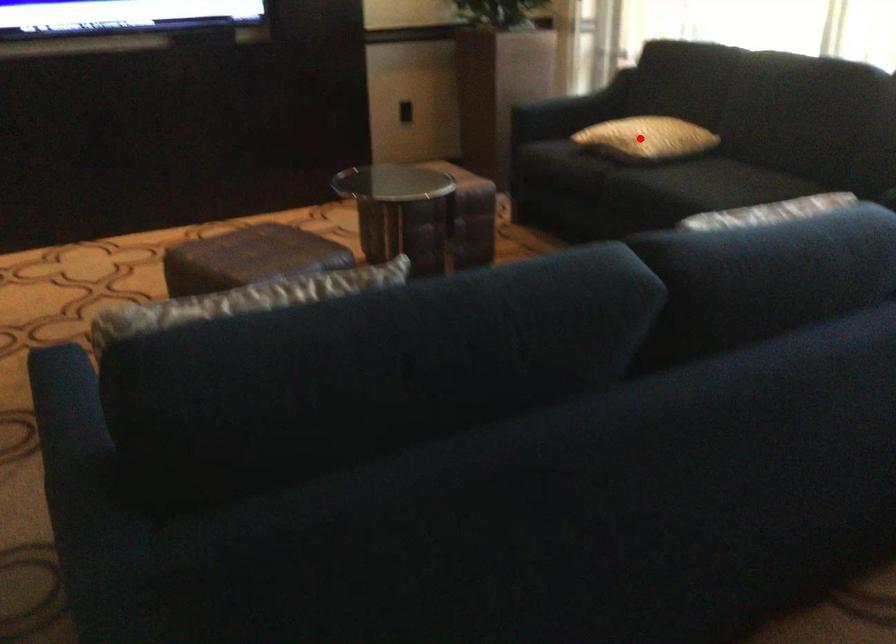
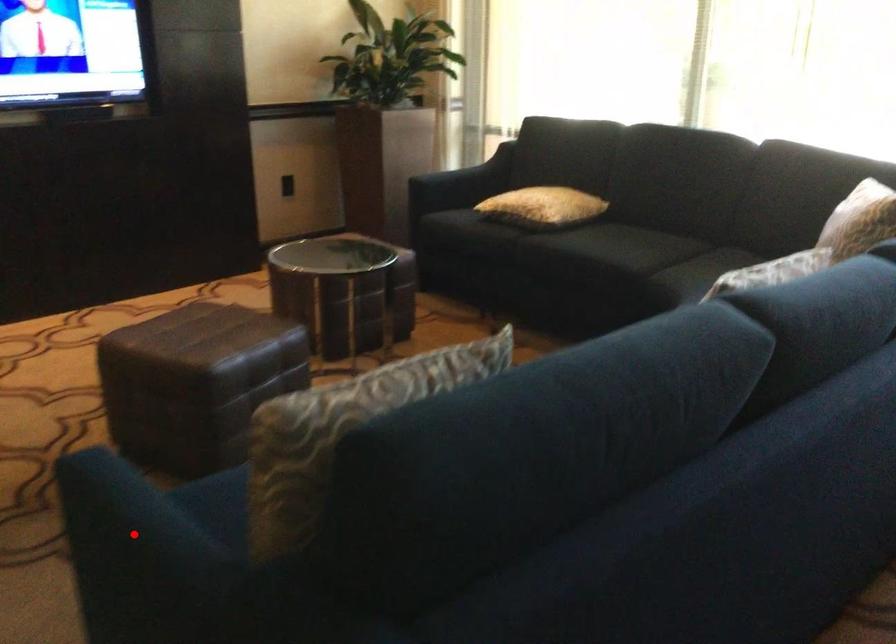
Consider the image. I am providing you with two images of the same scene from different viewpoints. A red point is marked on the first image and another point is marked on the second image. Is the marked point in image1 the same physical position as the marked point in image2?

No